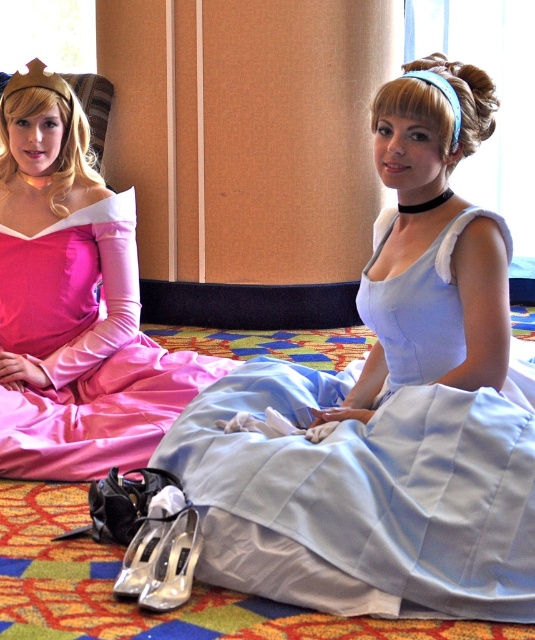
You are a photographer at a Disney event. You need to capture a closeup of the clear plastic shoe at lower center and the silver metallic shoe at lower center. Which shoe should you focus on first if you want to ensure both are in focus without moving the camera?

The clear plastic shoe at lower center is in front of the silver metallic shoe at lower center, so focusing on the clear plastic shoe at lower center first will ensure both are in focus since it is closer to the camera.